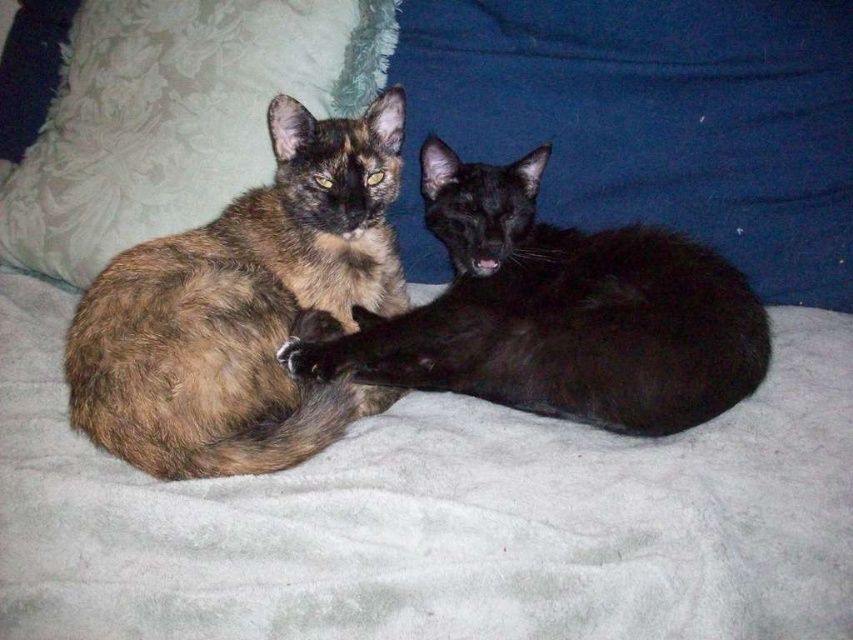
Can you confirm if tortoiseshell fur cat at left is bigger than brown tortoiseshell cat at center?

No, tortoiseshell fur cat at left is not bigger than brown tortoiseshell cat at center.

Is tortoiseshell fur cat at left above brown tortoiseshell cat at center?

Correct, tortoiseshell fur cat at left is located above brown tortoiseshell cat at center.

Which is behind, point (361, 401) or point (662, 289)?

Positioned behind is point (361, 401).

This screenshot has height=640, width=853. Identify the location of tortoiseshell fur cat at left. (244, 308).

Is blue fabric pillow at upper center closer to the viewer compared to brown tortoiseshell cat at center?

No, blue fabric pillow at upper center is behind brown tortoiseshell cat at center.

Describe the element at coordinates (648, 122) in the screenshot. The width and height of the screenshot is (853, 640). I see `blue fabric pillow at upper center` at that location.

I want to click on blue fabric pillow at upper center, so click(x=648, y=122).

Find the location of a particular element. The height and width of the screenshot is (640, 853). blue fabric pillow at upper center is located at coordinates (648, 122).

In the scene shown: Can you confirm if brown tortoiseshell cat at center is wider than white fluffy pillow at upper left?

No, brown tortoiseshell cat at center is not wider than white fluffy pillow at upper left.

Find the location of a particular element. This screenshot has height=640, width=853. brown tortoiseshell cat at center is located at coordinates (x=560, y=312).